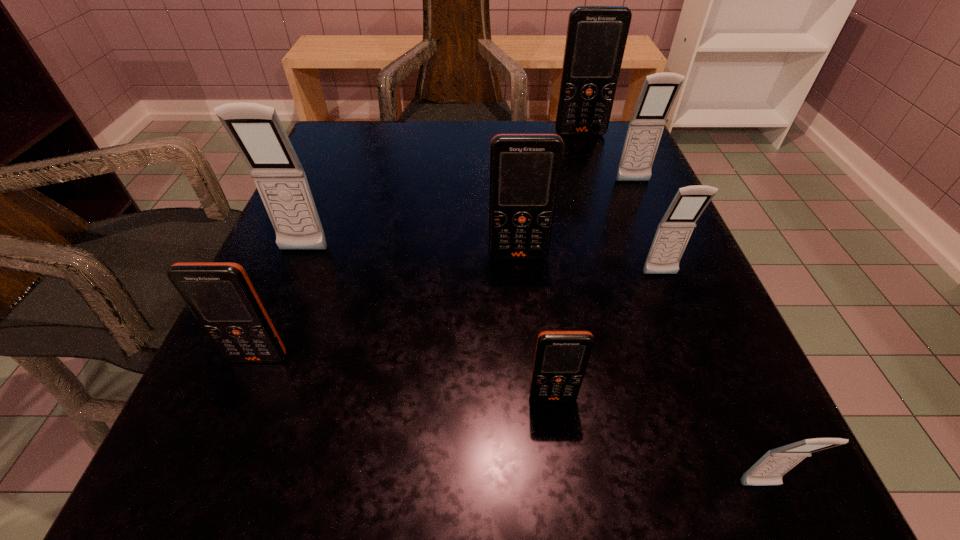
I want to click on gray cellular telephone that is the second closest to the rightmost orange cellular telephone, so click(x=673, y=233).